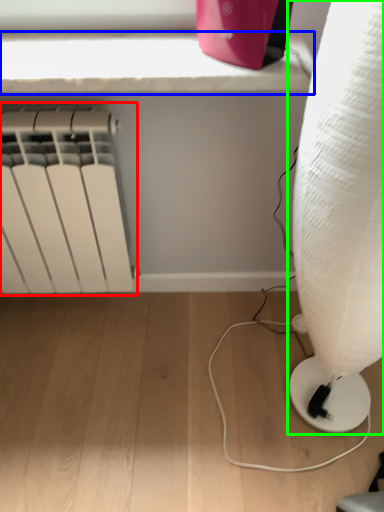
Question: Based on their relative distances, which object is farther from radiator (highlighted by a red box)? Choose from window sill (highlighted by a blue box) and lamp (highlighted by a green box).

Choices:
 (A) window sill
 (B) lamp

Answer: (B)